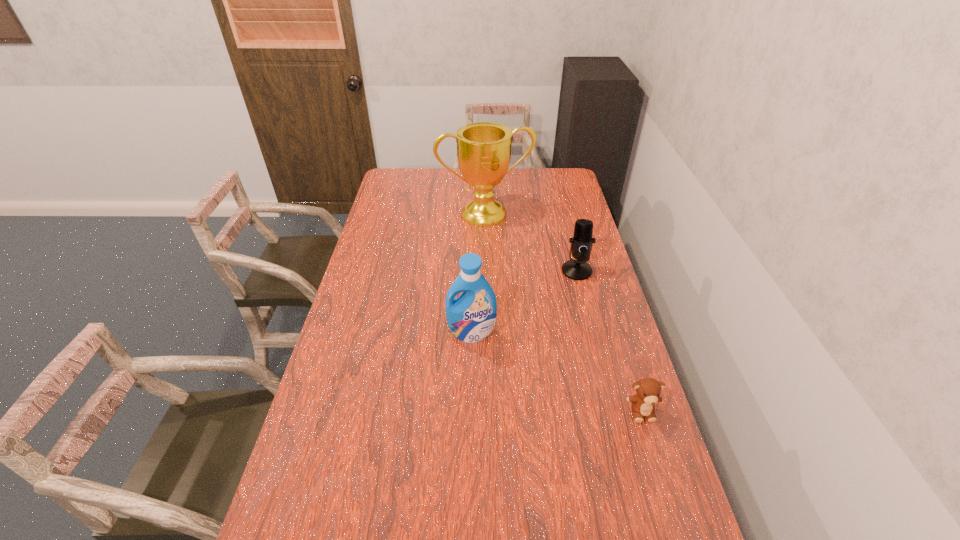
Locate an element on the screen. The image size is (960, 540). vacant point located between the detergent and the second farthest object is located at coordinates (524, 302).

Find the location of a particular element. The width and height of the screenshot is (960, 540). vacant region between the second nearest object and the second shortest object is located at coordinates (524, 302).

This screenshot has height=540, width=960. I want to click on vacant region between the award and the shortest object, so click(x=564, y=313).

Identify the location of empty space between the third tallest object and the second nearest object. This screenshot has width=960, height=540. (524, 302).

I want to click on object that is the second closest to the farthest object, so click(471, 317).

Choose which object is the second nearest neighbor to the shortest object. Please provide its 2D coordinates. Your answer should be formatted as a tuple, i.e. [(x, y)], where the tuple contains the x and y coordinates of a point satisfying the conditions above.

[(581, 243)]